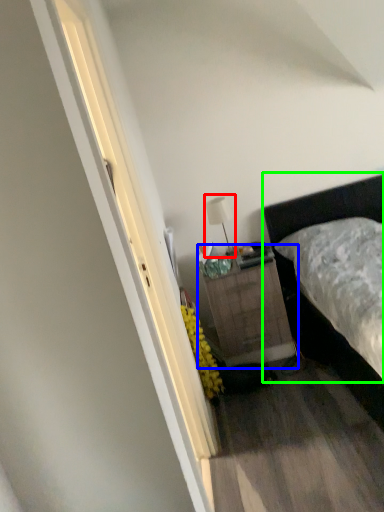
Question: Estimate the real-world distances between objects in this image. Which object is farther from table lamp (highlighted by a red box), nightstand (highlighted by a blue box) or bed (highlighted by a green box)?

Choices:
 (A) nightstand
 (B) bed

Answer: (B)